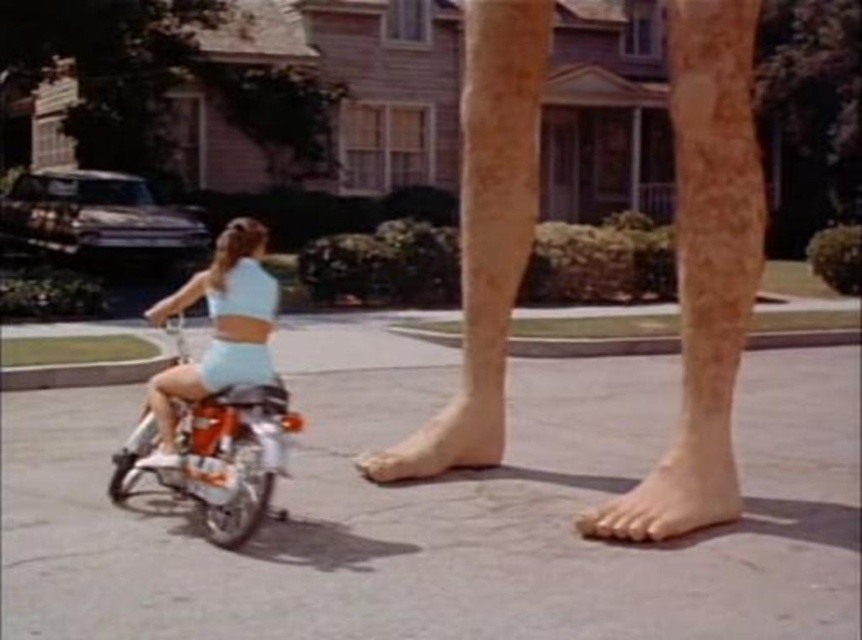
From the picture: You are a delivery person trying to navigate through a suburban neighborhood. You see an orange metallic motorcycle at lower left and a smooth skin foot at lower right. Which object should you avoid to prevent collision while driving?

The orange metallic motorcycle at lower left is larger in size than the smooth skin foot at lower right, so you should avoid the orange metallic motorcycle at lower left to prevent collision while driving.

In the surreal suburban scene, you notice an orange metallic motorcycle at lower left and a skinny barefoot at lower center. Which object is located more to the left side?

The orange metallic motorcycle at lower left is positioned on the left side of skinny barefoot at lower center, so it is more to the left.